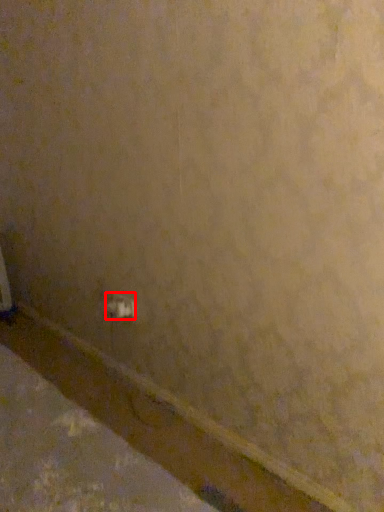
Question: From the image's perspective, considering the relative positions of power plugs and sockets (annotated by the red box) and molding in the image provided, where is power plugs and sockets (annotated by the red box) located with respect to the staircase?

Choices:
 (A) below
 (B) above

Answer: (B)